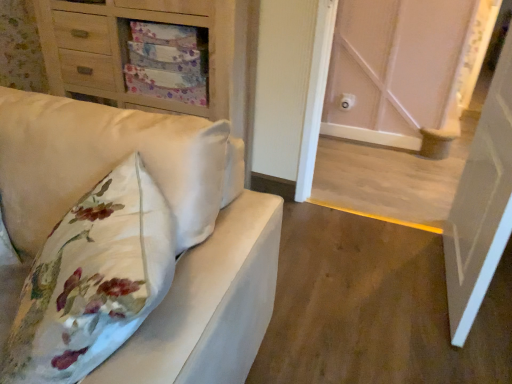
Question: Can you confirm if white wood door at center, the second door in the front-to-back sequence, is shorter than white glossy door at right, acting as the 1th door starting from the front?

Choices:
 (A) yes
 (B) no

Answer: (A)

Question: Is white wood door at center, the second door in the front-to-back sequence, touching white glossy door at right, which ranks as the 2th door in back-to-front order?

Choices:
 (A) yes
 (B) no

Answer: (B)

Question: Is white wood door at center, the second door in the front-to-back sequence, thinner than white glossy door at right, acting as the 1th door starting from the front?

Choices:
 (A) no
 (B) yes

Answer: (B)

Question: From a real-world perspective, is white wood door at center, arranged as the 1th door when viewed from the back, beneath white glossy door at right, acting as the 1th door starting from the front?

Choices:
 (A) no
 (B) yes

Answer: (B)

Question: From the image's perspective, is white wood door at center, arranged as the 1th door when viewed from the back, over white glossy door at right, which ranks as the 2th door in back-to-front order?

Choices:
 (A) yes
 (B) no

Answer: (A)

Question: Does white wood door at center, the second door in the front-to-back sequence, appear on the left side of white glossy door at right, acting as the 1th door starting from the front?

Choices:
 (A) yes
 (B) no

Answer: (A)

Question: From the image's perspective, is matte white sofa at left on top of matte wood chest of drawers at upper left?

Choices:
 (A) no
 (B) yes

Answer: (A)

Question: From a real-world perspective, is matte white sofa at left over matte wood chest of drawers at upper left?

Choices:
 (A) yes
 (B) no

Answer: (B)

Question: From a real-world perspective, is matte white sofa at left under matte wood chest of drawers at upper left?

Choices:
 (A) yes
 (B) no

Answer: (A)

Question: Is matte white sofa at left facing away from matte wood chest of drawers at upper left?

Choices:
 (A) no
 (B) yes

Answer: (B)

Question: Is matte white sofa at left wider than matte wood chest of drawers at upper left?

Choices:
 (A) yes
 (B) no

Answer: (A)

Question: Are matte white sofa at left and matte wood chest of drawers at upper left far apart?

Choices:
 (A) no
 (B) yes

Answer: (A)

Question: From the image's perspective, is white glossy door at right, which ranks as the 2th door in back-to-front order, under white wood door at center, the second door in the front-to-back sequence?

Choices:
 (A) no
 (B) yes

Answer: (B)